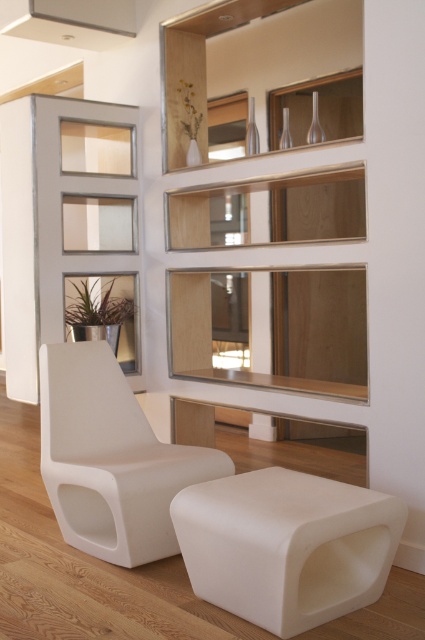
Is white matte/styrene stool at center positioned behind white matte armchair at center?

No, white matte/styrene stool at center is in front of white matte armchair at center.

Find the location of a particular element. white matte/styrene stool at center is located at coordinates (286, 545).

I want to click on white matte/styrene stool at center, so click(286, 545).